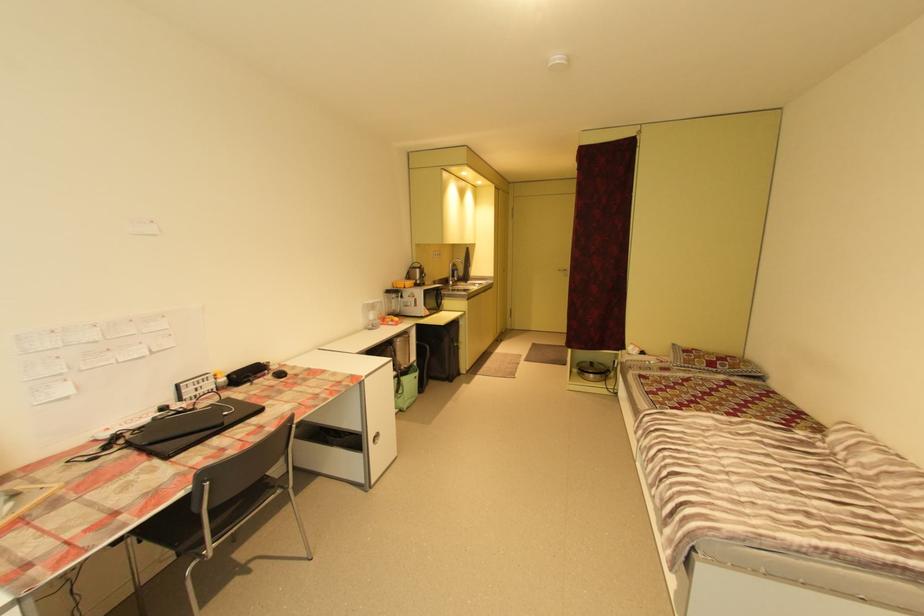
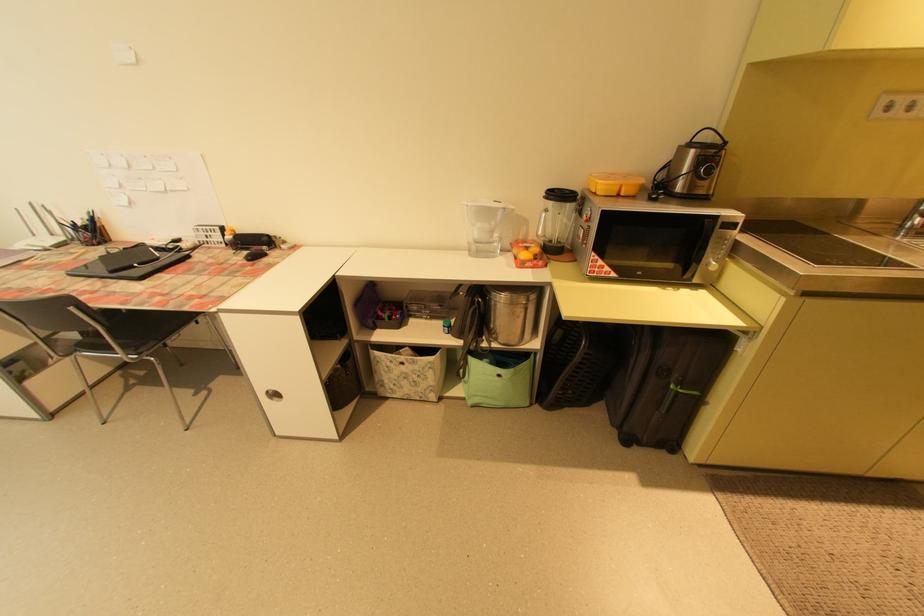
In the second image, find the point that corresponds to point (416, 399) in the first image.

(492, 398)